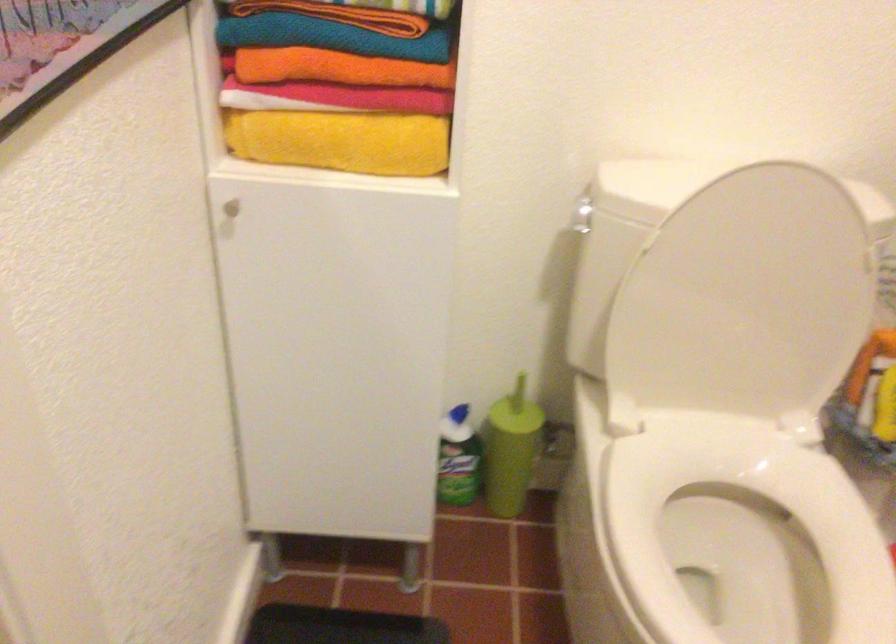
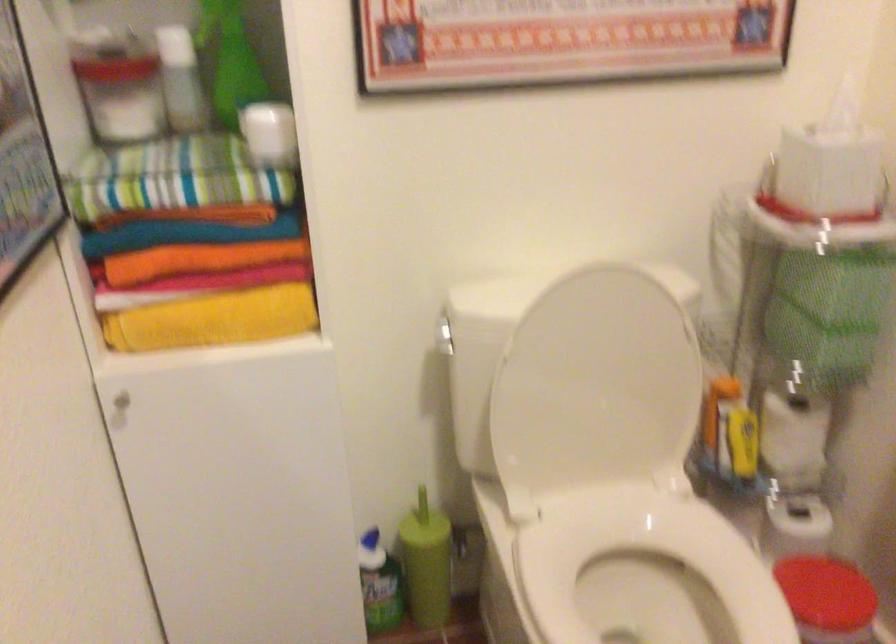
The point at (x=582, y=214) is marked in the first image. Where is the corresponding point in the second image?

(444, 336)